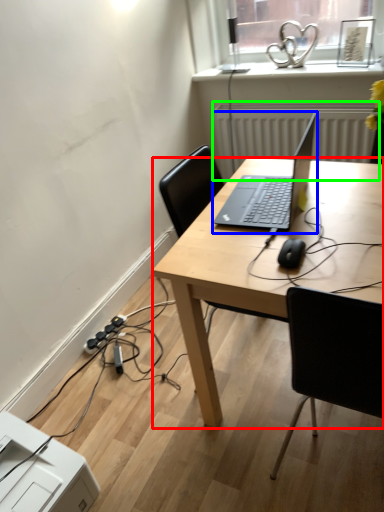
Question: Which object is positioned closest to desk (highlighted by a red box)? Select from laptop (highlighted by a blue box) and radiator (highlighted by a green box).

Choices:
 (A) laptop
 (B) radiator

Answer: (A)